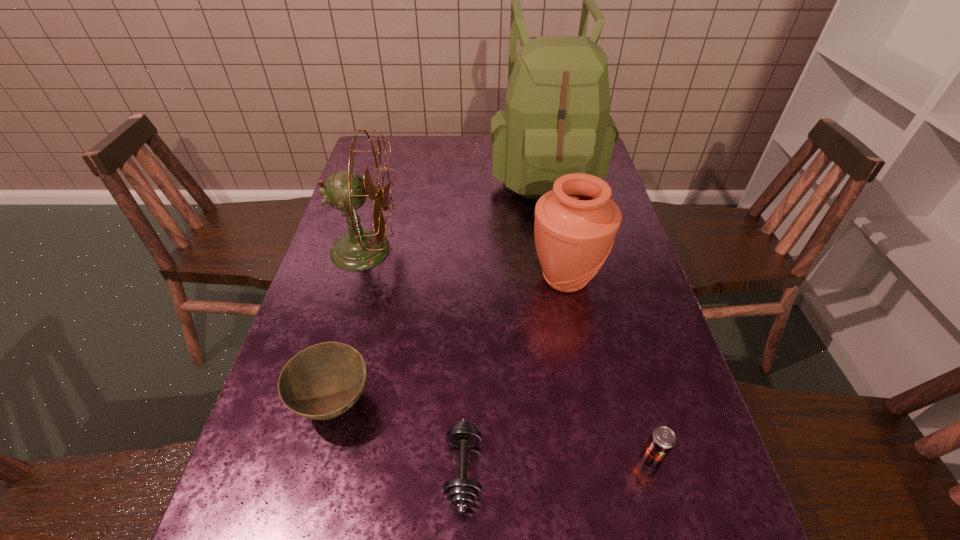
This screenshot has width=960, height=540. What are the coordinates of `free spot located on the front of the fourth shortest object` in the screenshot? It's located at [x=599, y=452].

The width and height of the screenshot is (960, 540). I want to click on free space located 0.360m on the right of the bowl, so click(x=553, y=403).

What are the coordinates of `vacant area located on the back of the beer can` in the screenshot? It's located at (612, 320).

You are a GUI agent. You are given a task and a screenshot of the screen. Output one action in this format:
    pyautogui.click(x=<x>, y=<y>)
    Task: Click on the vacant space situated 0.400m on the right of the dumbbell
    This screenshot has width=960, height=540.
    Given the screenshot: What is the action you would take?
    pyautogui.click(x=704, y=470)

Where is `object at the far edge`? The image size is (960, 540). object at the far edge is located at coordinates (556, 121).

Locate an element on the screen. fan that is positioned at the left edge is located at coordinates (359, 249).

Find the location of a particular element. bowl at the left edge is located at coordinates (321, 382).

Locate an element on the screen. This screenshot has width=960, height=540. backpack that is at the right edge is located at coordinates (556, 121).

What are the coordinates of `vase situated at the right edge` in the screenshot? It's located at (575, 225).

Locate an element on the screen. The width and height of the screenshot is (960, 540). beer can that is positioned at the right edge is located at coordinates (662, 440).